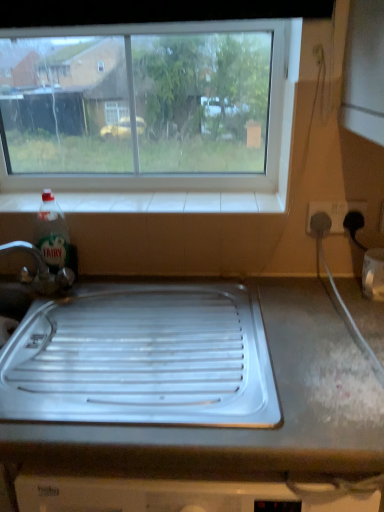
Question: Is transparent glass window at upper center inside white plastic socket at right?

Choices:
 (A) yes
 (B) no

Answer: (B)

Question: From the image's perspective, is white plastic socket at right located beneath transparent glass window at upper center?

Choices:
 (A) yes
 (B) no

Answer: (A)

Question: Is white plastic socket at right in front of transparent glass window at upper center?

Choices:
 (A) yes
 (B) no

Answer: (A)

Question: Is white plastic socket at right taller than transparent glass window at upper center?

Choices:
 (A) yes
 (B) no

Answer: (B)

Question: Considering the relative sizes of white plastic socket at right and transparent glass window at upper center in the image provided, is white plastic socket at right smaller than transparent glass window at upper center?

Choices:
 (A) yes
 (B) no

Answer: (A)

Question: Is white tile at upper center bigger or smaller than metallic gray tray at center?

Choices:
 (A) big
 (B) small

Answer: (B)

Question: From the image's perspective, relative to metallic gray tray at center, is white tile at upper center above or below?

Choices:
 (A) below
 (B) above

Answer: (B)

Question: Is white tile at upper center to the left or to the right of metallic gray tray at center in the image?

Choices:
 (A) left
 (B) right

Answer: (A)

Question: Does point tap(99, 196) appear closer or farther from the camera than point tap(145, 317)?

Choices:
 (A) farther
 (B) closer

Answer: (A)

Question: Is point (140, 335) positioned closer to the camera than point (54, 253)?

Choices:
 (A) farther
 (B) closer

Answer: (B)

Question: From the image's perspective, is metallic gray tray at center above or below green translucent liquid at bottle left?

Choices:
 (A) below
 (B) above

Answer: (A)

Question: From a real-world perspective, is metallic gray tray at center positioned above or below green translucent liquid at bottle left?

Choices:
 (A) below
 (B) above

Answer: (A)

Question: Is metallic gray tray at center inside the boundaries of green translucent liquid at bottle left, or outside?

Choices:
 (A) outside
 (B) inside

Answer: (A)

Question: Considering the positions of point (51, 222) and point (114, 440), is point (51, 222) closer or farther from the camera than point (114, 440)?

Choices:
 (A) farther
 (B) closer

Answer: (A)

Question: Looking at the image, does green translucent liquid at bottle left seem bigger or smaller compared to metallic gray tray at center?

Choices:
 (A) small
 (B) big

Answer: (A)